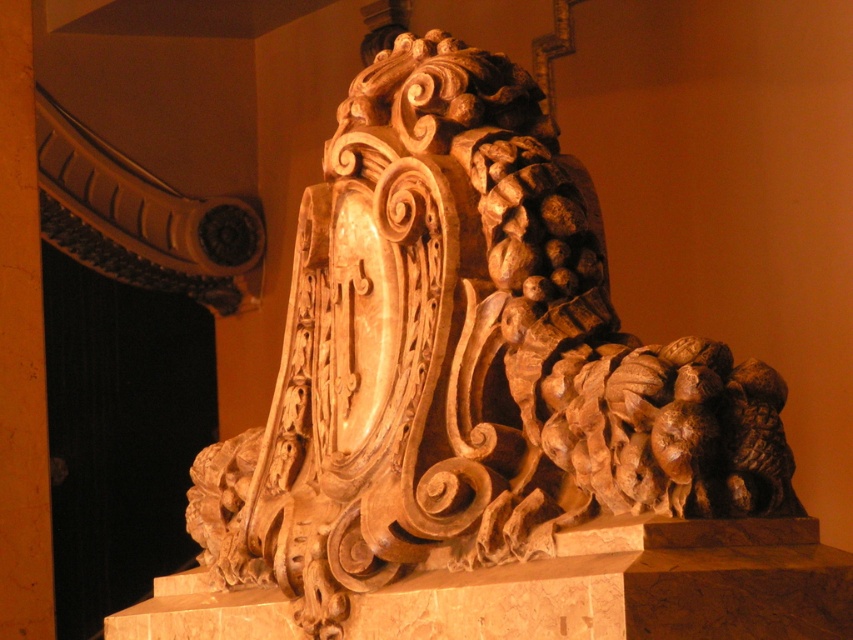
You are standing in front of the architectural carving described. There is a specific point at coordinates point [378,205] that you want to touch with your hand. Considering your arm can reach up to 2.5 meters, can you reach that point without moving closer to the carving?

The distance of point [378,205] from viewer is 62.27 feet, which converts to approximately 19 meters. Since your arm can only reach up to 2.5 meters, you cannot reach the point without moving closer to the carving.

Consider the image. You are an architect examining the intricate wooden carving at the center of the image. You notice a specific point marked at coordinates (x=465, y=362). Based on the carving details, where exactly is this point located?

The point at (x=465, y=362) is on the wooden carving at center.

You are an interior designer examining the intricate carvings in this space. You notice the wooden carving at center and the orange polished wood at upper left. Which object is located to the right of the other?

The wooden carving at center is positioned on the right side of orange polished wood at upper left.